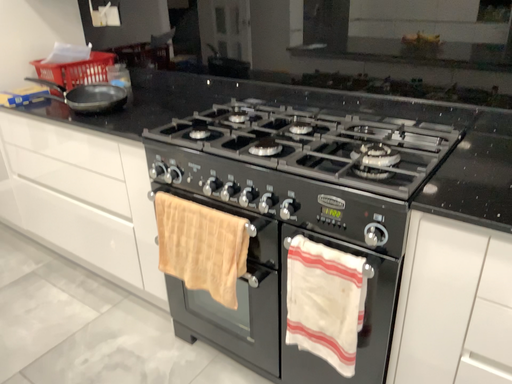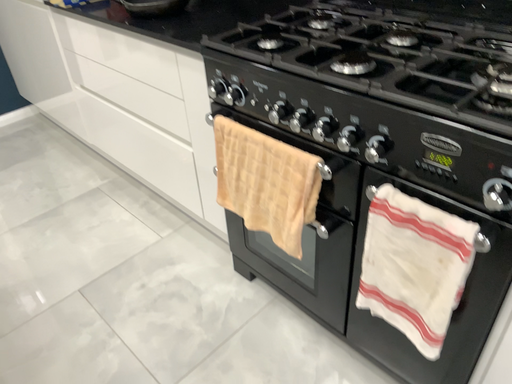
Question: How did the camera likely rotate when shooting the video?

Choices:
 (A) rotated right
 (B) rotated left

Answer: (B)